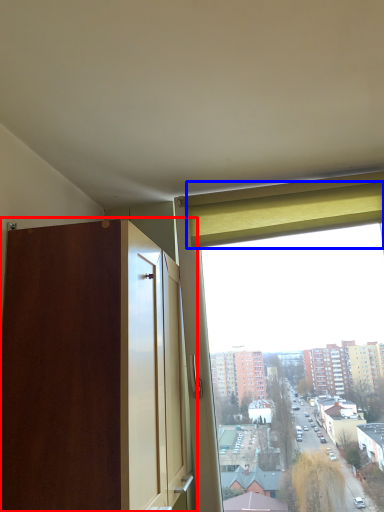
Question: Among these objects, which one is nearest to the camera, dresser (highlighted by a red box) or curtain (highlighted by a blue box)?

Choices:
 (A) dresser
 (B) curtain

Answer: (A)